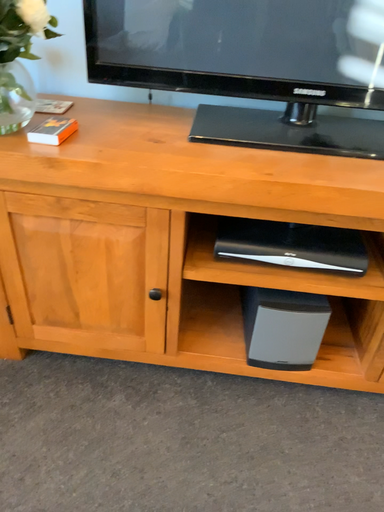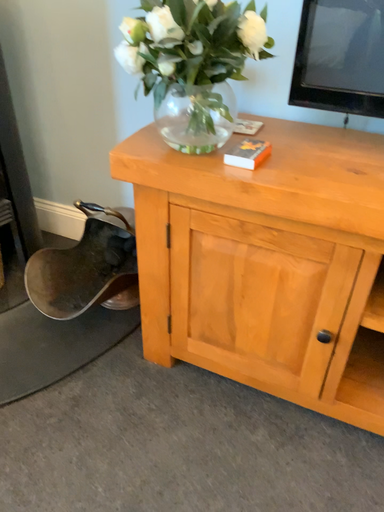
Question: How did the camera likely rotate when shooting the video?

Choices:
 (A) rotated left
 (B) rotated right

Answer: (A)